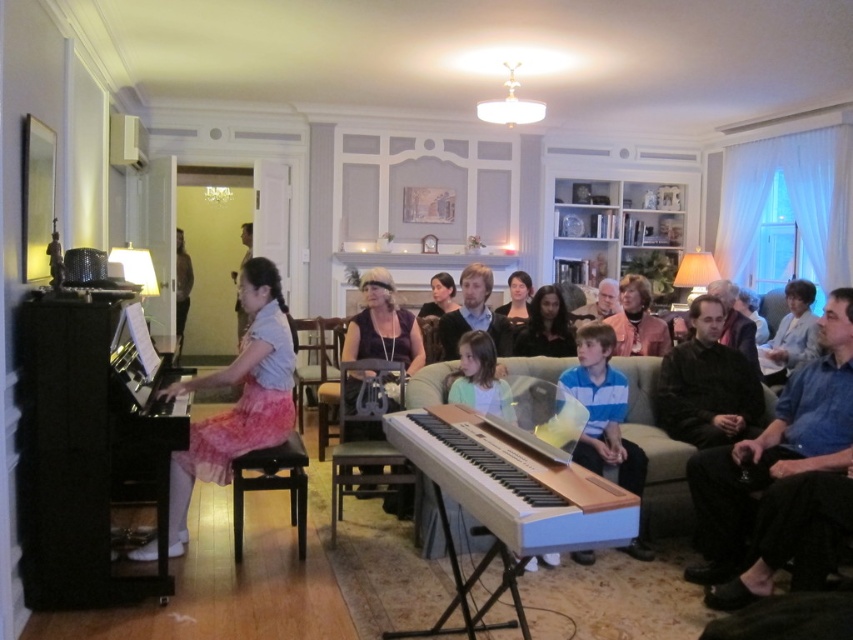
Is point (177, 476) farther from viewer compared to point (593, 467)?

No, (177, 476) is closer to viewer.

Between point (216, 476) and point (592, 563), which one is positioned behind?

Positioned behind is point (592, 563).

Measure the distance between pink satin skirt at center and camera.

They are 10.16 feet apart.

You are a GUI agent. You are given a task and a screenshot of the screen. Output one action in this format:
    pyautogui.click(x=<x>, y=<y>)
    Task: Click on the pink satin skirt at center
    Image resolution: width=853 pixels, height=640 pixels.
    Given the screenshot: What is the action you would take?
    pyautogui.click(x=238, y=397)

Can you confirm if pink satin skirt at center is wider than dark brown leather jacket at left?

Yes, pink satin skirt at center is wider than dark brown leather jacket at left.

Is pink satin skirt at center positioned in front of dark brown leather jacket at left?

Yes, it is.

What do you see at coordinates (238, 397) in the screenshot?
I see `pink satin skirt at center` at bounding box center [238, 397].

Identify the location of pink satin skirt at center. The width and height of the screenshot is (853, 640). (238, 397).

Measure the distance between smooth black shirt at center and light blue fabric shirt at right.

smooth black shirt at center and light blue fabric shirt at right are 2.48 meters apart from each other.

From the picture: Is smooth black shirt at center to the left of light blue fabric shirt at right from the viewer's perspective?

Indeed, smooth black shirt at center is positioned on the left side of light blue fabric shirt at right.

Who is more distant from viewer, (474, 321) or (784, 291)?

Positioned behind is point (784, 291).

The image size is (853, 640). I want to click on smooth black shirt at center, so click(x=473, y=314).